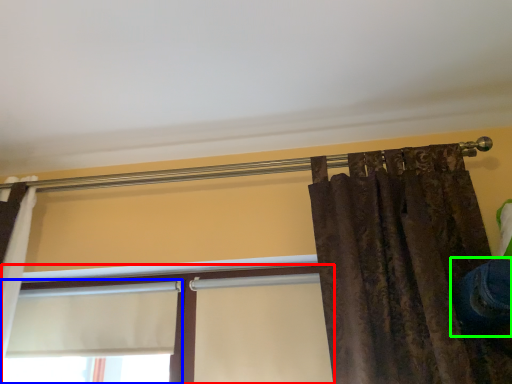
Question: Based on their relative distances, which object is farther from window (highlighted by a red box)? Choose from window (highlighted by a blue box) and jeans (highlighted by a green box).

Choices:
 (A) window
 (B) jeans

Answer: (B)